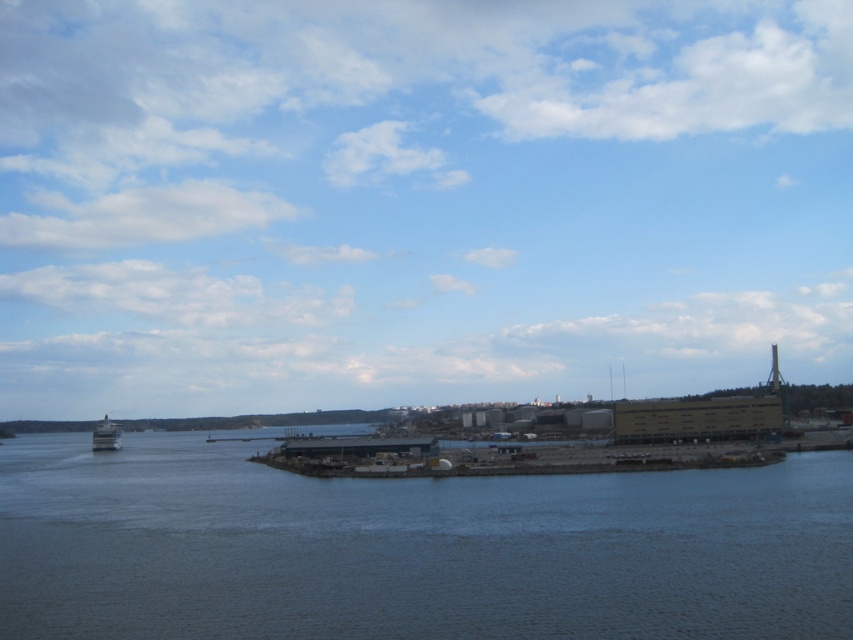
Who is lower down, dark blue water at lower center or metallic gray boat at left?

Positioned lower is metallic gray boat at left.

Is point (432, 593) positioned after point (105, 444)?

No, (432, 593) is in front of (105, 444).

Where is `dark blue water at lower center`? dark blue water at lower center is located at coordinates (412, 548).